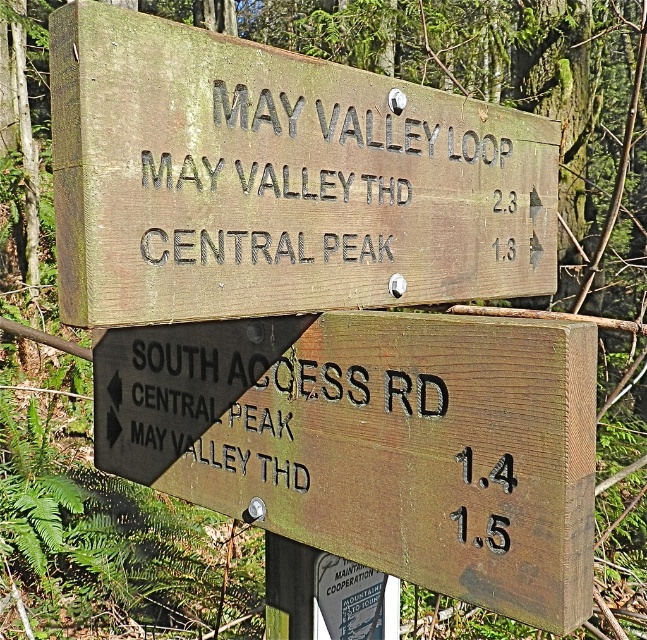
Does weathered wood sign at upper center appear under weathered wood sign at lower right?

Incorrect, weathered wood sign at upper center is not positioned below weathered wood sign at lower right.

Which is above, weathered wood sign at upper center or weathered wood sign at lower right?

weathered wood sign at upper center is higher up.

Is point (455, 148) farther from viewer compared to point (397, 420)?

Yes, point (455, 148) is farther from viewer.

This screenshot has width=647, height=640. Find the location of `weathered wood sign at upper center`. weathered wood sign at upper center is located at coordinates (278, 180).